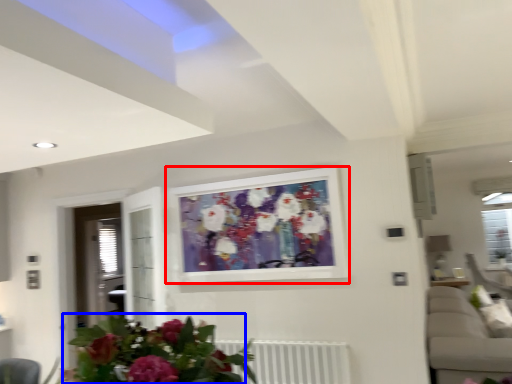
Question: Which of the following is the closest to the observer, picture frame (highlighted by a red box) or floral arrangement (highlighted by a blue box)?

Choices:
 (A) picture frame
 (B) floral arrangement

Answer: (B)